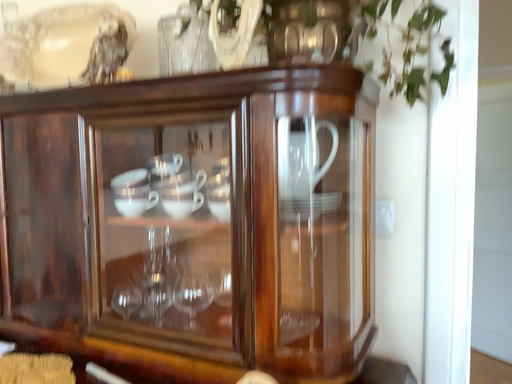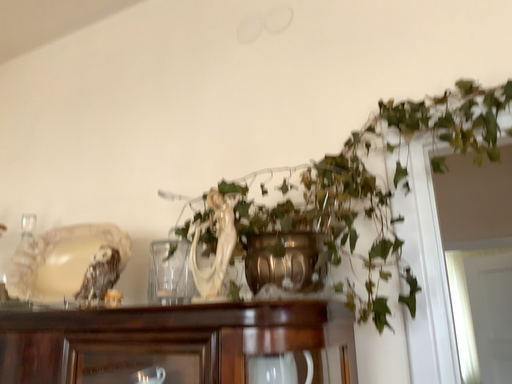
Question: How did the camera likely rotate when shooting the video?

Choices:
 (A) rotated upward
 (B) rotated downward

Answer: (A)